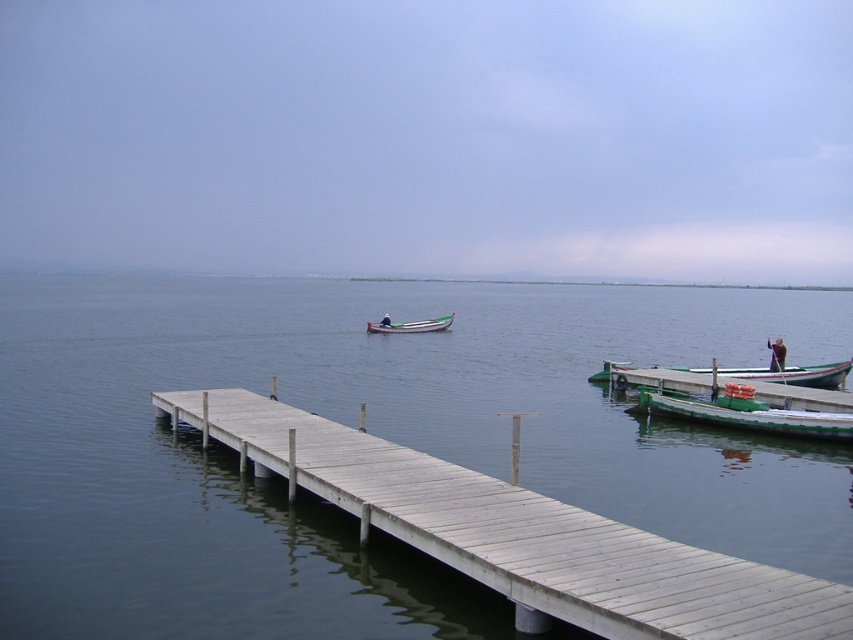
Question: From the image, what is the correct spatial relationship of light gray wooden dock at center in relation to dark blue fabric at center?

Choices:
 (A) left
 (B) right

Answer: (A)

Question: Which point is farther to the camera?

Choices:
 (A) green matte boat at lower right
 (B) dark blue fabric at center

Answer: (B)

Question: Which of the following is the farthest from the observer?

Choices:
 (A) (575, 589)
 (B) (798, 384)

Answer: (B)

Question: Which point is closer to the camera?

Choices:
 (A) green wooden boat at center
 (B) green matte boat at lower right
 (C) green wooden boat at right
 (D) light gray wooden dock at center

Answer: (D)

Question: Is green wooden boat at center behind dark blue fabric at center?

Choices:
 (A) no
 (B) yes

Answer: (B)

Question: Does green matte boat at lower right appear on the left side of dark blue fabric at center?

Choices:
 (A) yes
 (B) no

Answer: (A)